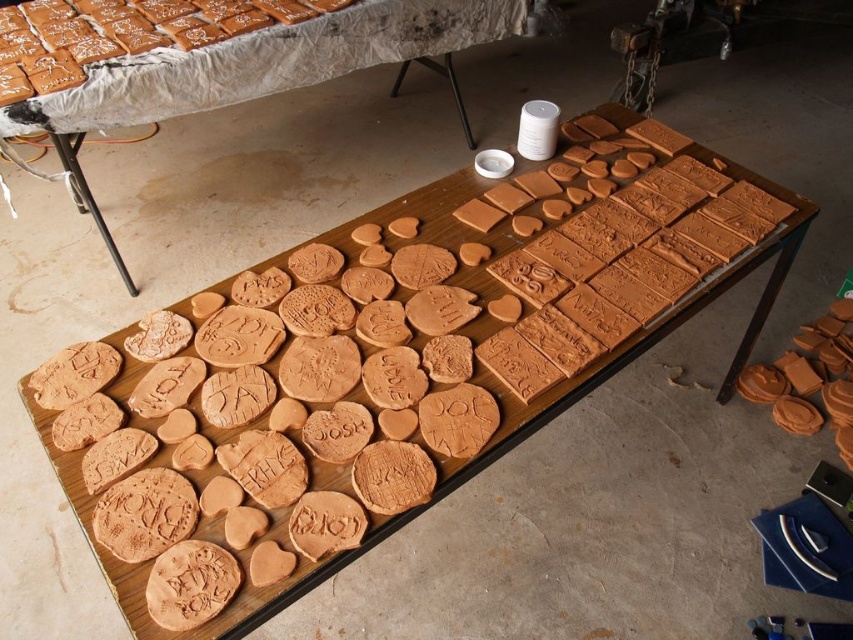
Can you confirm if matte clay tiles at center is positioned to the right of matte clay cookie at right?

No, matte clay tiles at center is not to the right of matte clay cookie at right.

Can you confirm if matte clay tiles at center is wider than matte clay cookie at right?

Indeed, matte clay tiles at center has a greater width compared to matte clay cookie at right.

Describe the element at coordinates (253, 72) in the screenshot. This screenshot has width=853, height=640. I see `matte clay tiles at center` at that location.

Where is `matte clay tiles at center`? This screenshot has height=640, width=853. matte clay tiles at center is located at coordinates (253, 72).

Is matte brown gingerbread at upper left in front of matte clay cookie at right?

Yes, matte brown gingerbread at upper left is closer to the viewer.

What do you see at coordinates (125, 33) in the screenshot? The image size is (853, 640). I see `matte brown gingerbread at upper left` at bounding box center [125, 33].

Identify the location of matte brown gingerbread at upper left. Image resolution: width=853 pixels, height=640 pixels. (125, 33).

Does matte clay tiles at center appear on the left side of white matte container at upper center?

Correct, you'll find matte clay tiles at center to the left of white matte container at upper center.

Which is behind, point (254, 42) or point (531, 108)?

Point (254, 42)

Find the location of a particular element. The height and width of the screenshot is (640, 853). matte clay tiles at center is located at coordinates (253, 72).

Where is `matte clay tiles at center`? The image size is (853, 640). matte clay tiles at center is located at coordinates (253, 72).